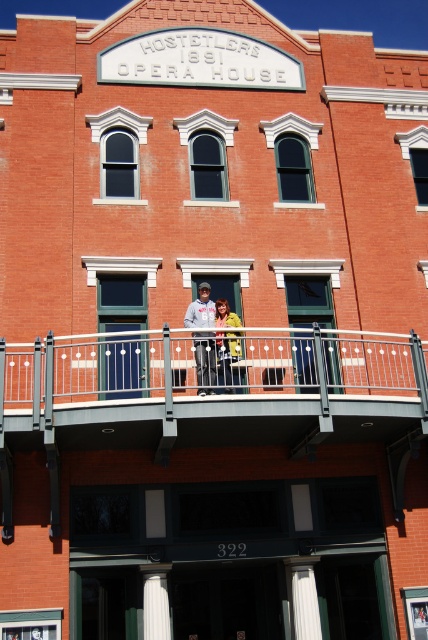
You are standing in front of the Hostetler Opera House. You see the metallic gray railing at upper center and the white marble column at lower center. Which object is closer to you?

The metallic gray railing at upper center is closer to you because it is in front of the white marble column at lower center.

Consider the image. You are a stagehand at the Hostetler Opera House and need to move a 2.5 meter long ladder between the matte gray hoodie at center and the yellow matte jacket at center. Can the ladder fit through the space between them?

The distance between the matte gray hoodie at center and the yellow matte jacket at center is 2.13 meters. Since the ladder is 2.5 meters long, it cannot fit through the space between them as the distance is shorter than the ladder.

You are a fashion designer observing the crowd at the Hostetler Opera House. You notice two people at the balcony wearing the matte gray hoodie at center and the yellow matte jacket at center. Which clothing item appears shorter in height?

The matte gray hoodie at center has a lesser height compared to the yellow matte jacket at center, so the matte gray hoodie at center appears shorter in height.